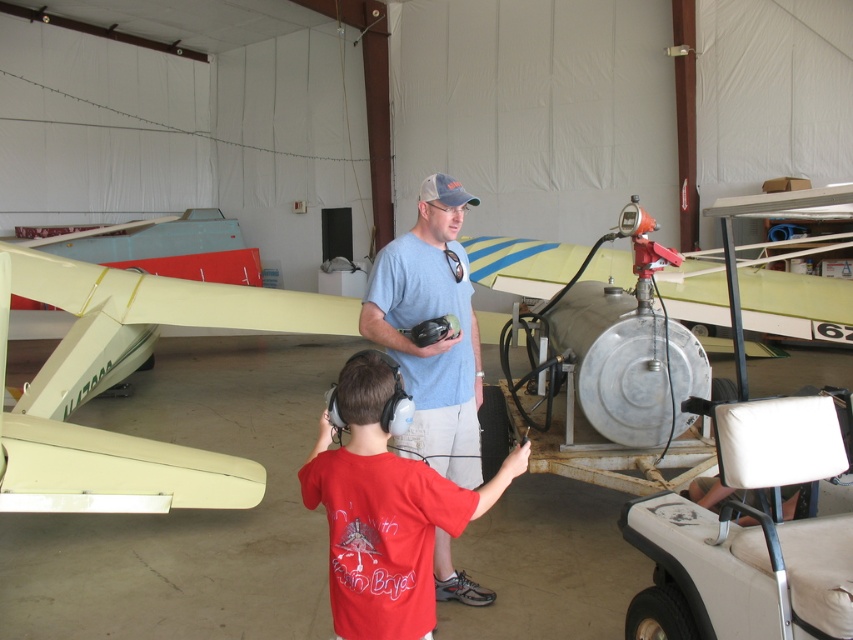
Between red cotton shirt at center and blue cotton t-shirt at center, which one appears on the left side from the viewer's perspective?

red cotton shirt at center

Between red cotton shirt at center and blue cotton t-shirt at center, which one has less height?

red cotton shirt at center is shorter.

Image resolution: width=853 pixels, height=640 pixels. What are the coordinates of `red cotton shirt at center` in the screenshot? It's located at (384, 513).

Does point (91, 305) lie in front of point (384, 524)?

No, (91, 305) is further to viewer.

Does light yellow plastic airplane at center have a larger size compared to red cotton shirt at center?

Yes.

Between point (73, 269) and point (387, 563), which one is positioned in front?

Point (387, 563) is in front.

The image size is (853, 640). Identify the location of light yellow plastic airplane at center. (120, 378).

Who is taller, light yellow plastic airplane at center or beige fabric golf cart at lower right?

light yellow plastic airplane at center

Who is positioned more to the right, light yellow plastic airplane at center or beige fabric golf cart at lower right?

beige fabric golf cart at lower right

Consider the image. Who is more forward, (x=170, y=465) or (x=660, y=525)?

Point (x=660, y=525)

Locate an element on the screen. The image size is (853, 640). light yellow plastic airplane at center is located at coordinates (120, 378).